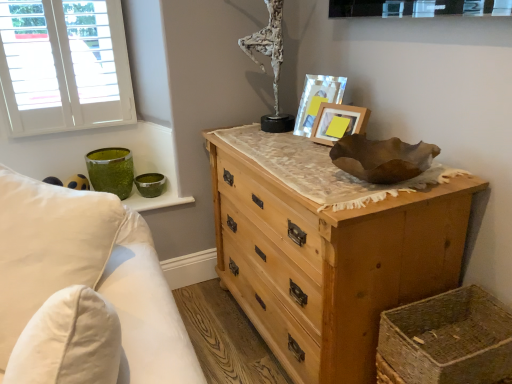
Question: Which is correct: white soft pillow at left is inside wooden picture frame at upper center, the second picture frame when ordered from back to front, or outside of it?

Choices:
 (A) outside
 (B) inside

Answer: (A)

Question: Is point (44, 203) closer or farther from the camera than point (333, 105)?

Choices:
 (A) farther
 (B) closer

Answer: (B)

Question: Considering the real-world distances, which object is closest to the wooden picture frame at upper center, arranged as the 1th picture frame when viewed from the front?

Choices:
 (A) matte wooden picture frame at upper right, which is the second picture frame in front-to-back order
 (B) white textured sculpture at upper center
 (C) natural wood chest of drawers at center
 (D) white painted wood window at upper left
 (E) white soft pillow at left

Answer: (A)

Question: Estimate the real-world distances between objects in this image. Which object is farther from the woven straw basket at lower right?

Choices:
 (A) white textured sculpture at upper center
 (B) white soft pillow at left
 (C) white painted wood window at upper left
 (D) natural wood chest of drawers at center
 (E) matte wooden picture frame at upper right, the 1th picture frame when ordered from back to front

Answer: (C)